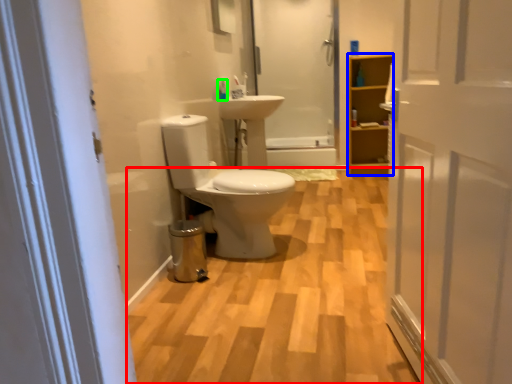
Question: Which object is the closest to the plain (highlighted by a red box)? Choose among these: cabinetry (highlighted by a blue box) or toiletry (highlighted by a green box).

Choices:
 (A) cabinetry
 (B) toiletry

Answer: (B)